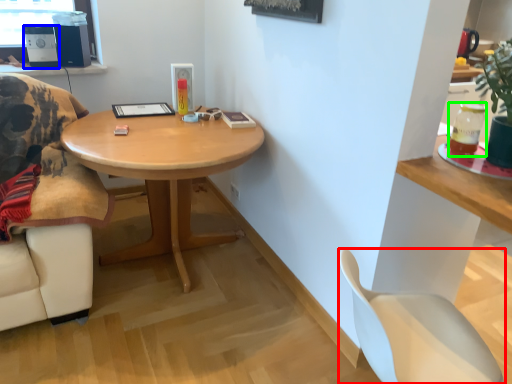
Question: Based on their relative distances, which object is nearer to chair (highlighted by a red box)? Choose from speaker (highlighted by a blue box) and beverage (highlighted by a green box).

Choices:
 (A) speaker
 (B) beverage

Answer: (B)